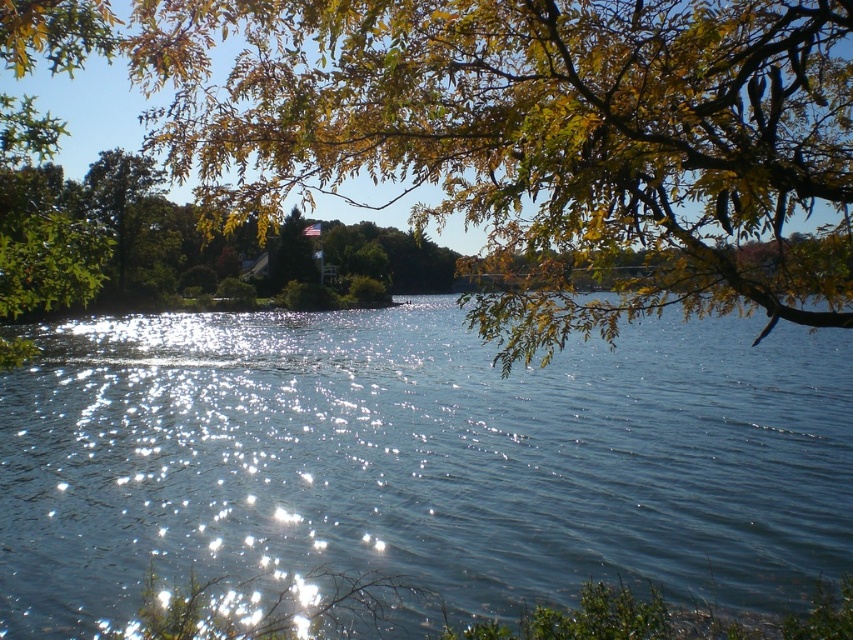
Question: Can you confirm if blue water at center is smaller than green leafy branches at upper center?

Choices:
 (A) no
 (B) yes

Answer: (A)

Question: Can you confirm if blue water at center is wider than green leafy branches at upper center?

Choices:
 (A) no
 (B) yes

Answer: (B)

Question: Among these objects, which one is farthest from the camera?

Choices:
 (A) green leafy branches at upper center
 (B) blue water at center

Answer: (B)

Question: Which point is closer to the camera?

Choices:
 (A) (799, 285)
 (B) (608, 500)

Answer: (A)

Question: Where is blue water at center located in relation to green leafy branches at upper center in the image?

Choices:
 (A) below
 (B) above

Answer: (A)